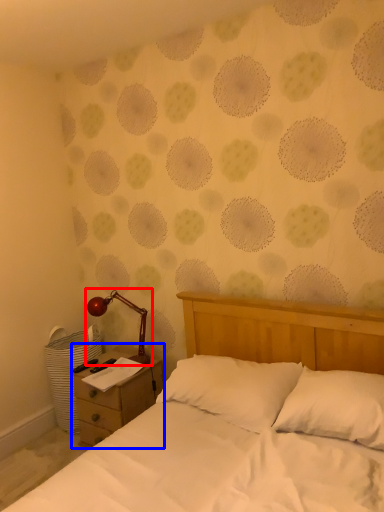
Question: Among these objects, which one is nearest to the camera, lamp (highlighted by a red box) or nightstand (highlighted by a blue box)?

Choices:
 (A) lamp
 (B) nightstand

Answer: (B)